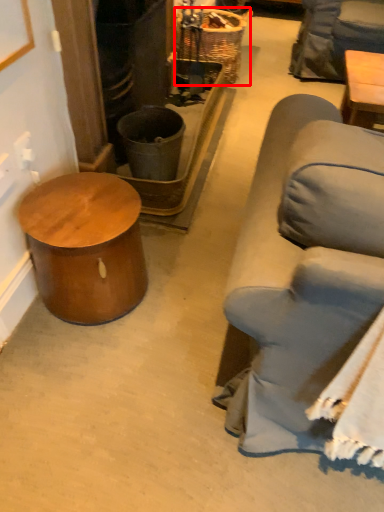
Question: From the image, what is the correct spatial relationship of basket (annotated by the red box) in relation to table?

Choices:
 (A) left
 (B) right

Answer: (B)